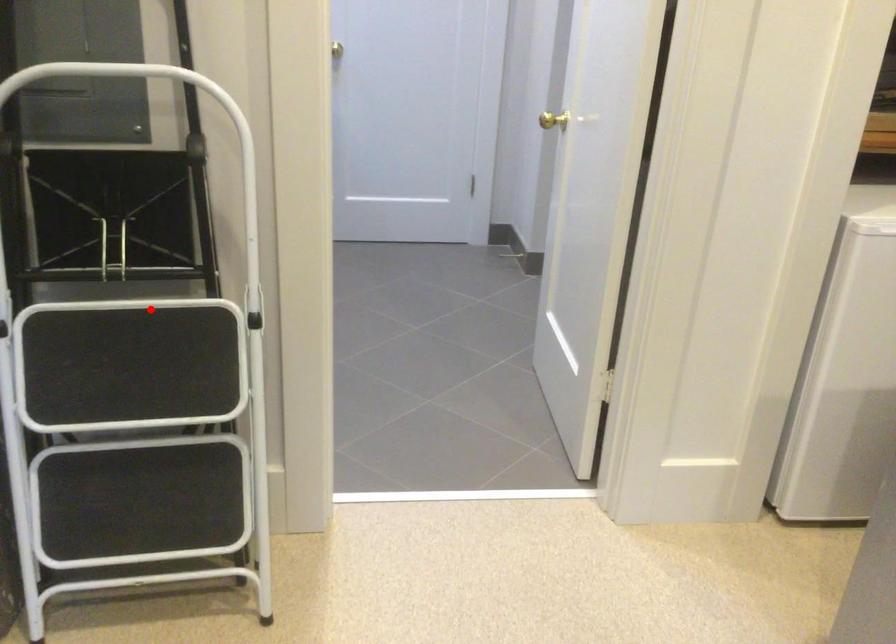
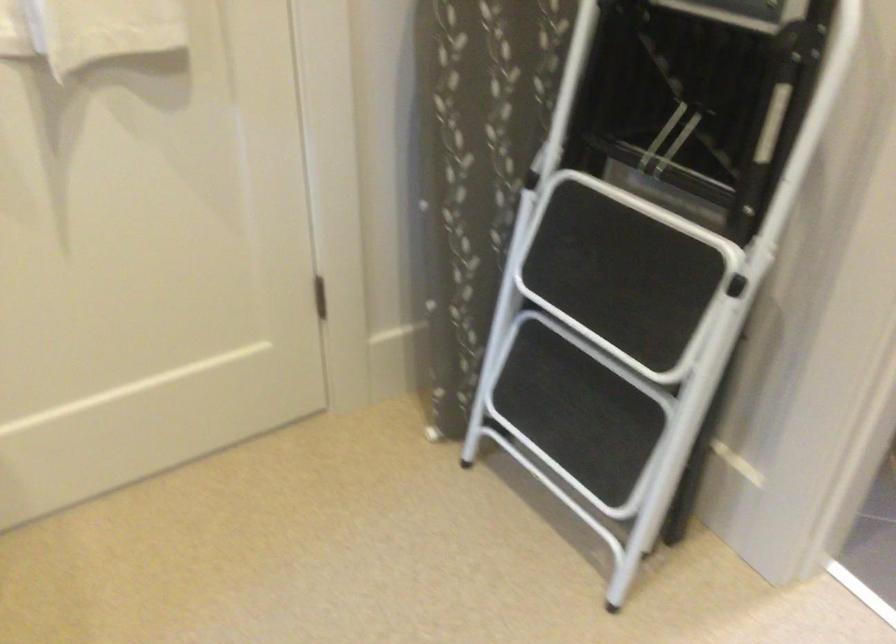
Question: I am providing you with two images of the same scene from different viewpoints. In image1, a red point is highlighted. Considering the same 3D point in image2, which of the following is correct?

Choices:
 (A) It is closer
 (B) It is farther

Answer: (A)